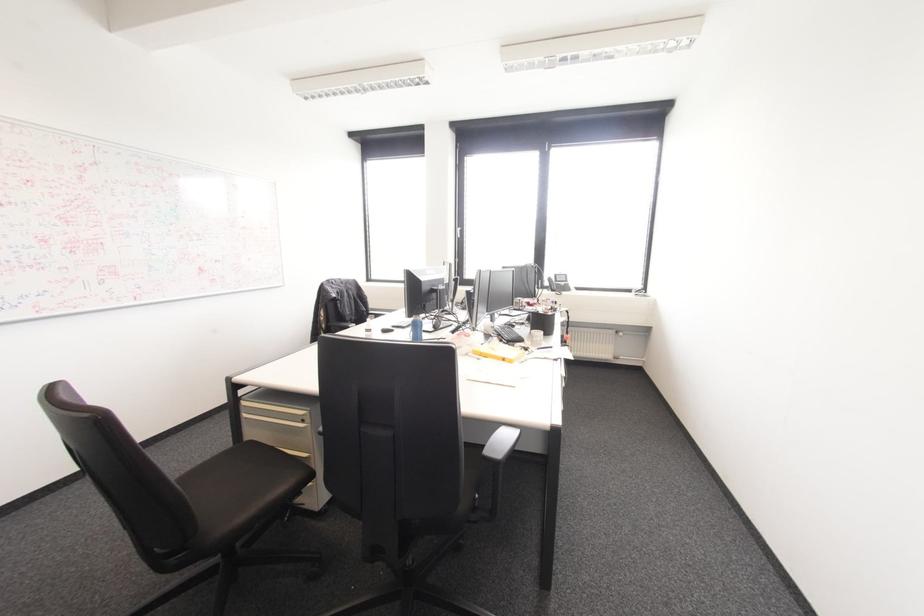
This screenshot has width=924, height=616. I want to click on blue water bottle, so point(416,329).